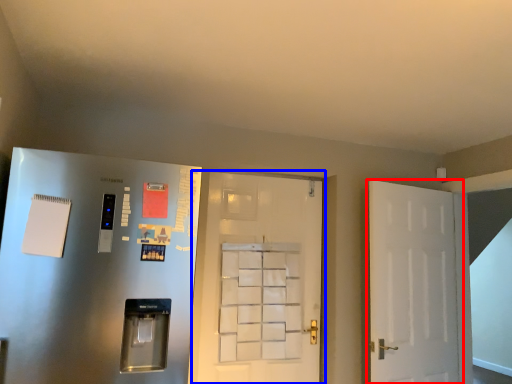
Question: Which object is further to the camera taking this photo, door (highlighted by a red box) or door (highlighted by a blue box)?

Choices:
 (A) door
 (B) door

Answer: (B)